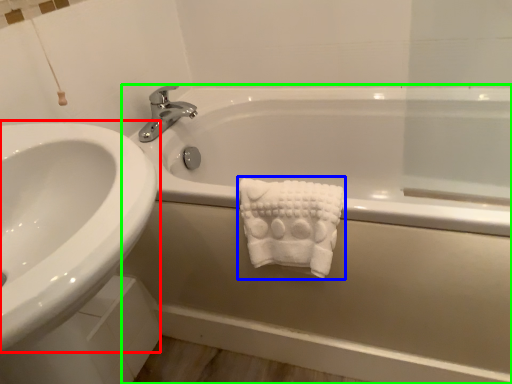
Question: Which is farther away from sink (highlighted by a red box)? bath towel (highlighted by a blue box) or bathtub (highlighted by a green box)?

Choices:
 (A) bath towel
 (B) bathtub

Answer: (B)